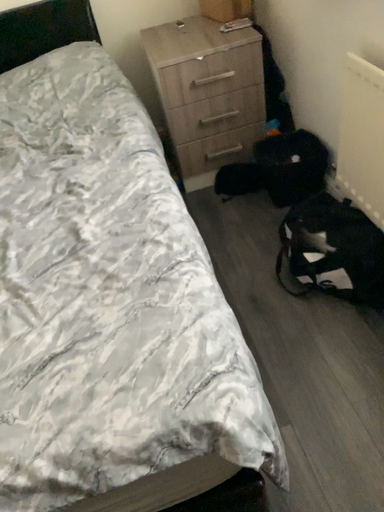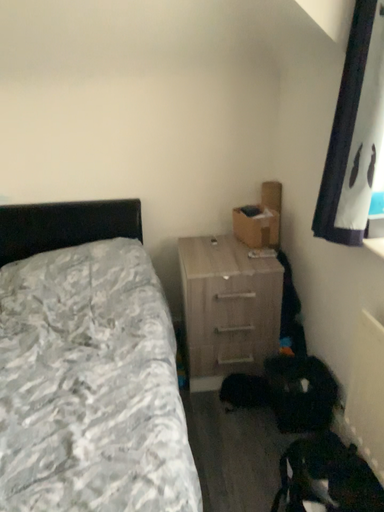
Question: How did the camera likely rotate when shooting the video?

Choices:
 (A) rotated downward
 (B) rotated upward

Answer: (B)